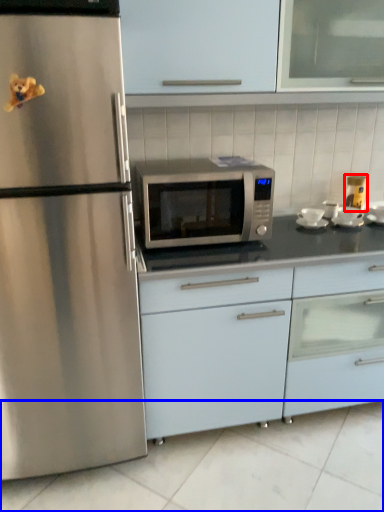
Question: Which object appears closest to the camera in this image, appliance (highlighted by a red box) or tile (highlighted by a blue box)?

Choices:
 (A) appliance
 (B) tile

Answer: (B)